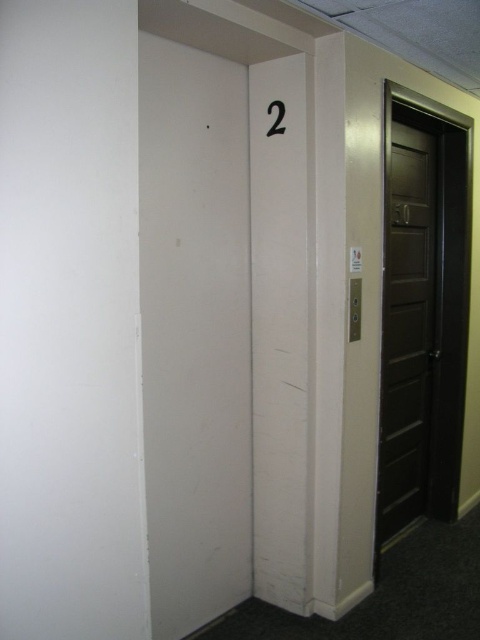
Question: Can you confirm if dark brown wooden door at right is smaller than black paper at upper center?

Choices:
 (A) no
 (B) yes

Answer: (A)

Question: Which point is farther from the camera taking this photo?

Choices:
 (A) (269, 125)
 (B) (385, 230)

Answer: (B)

Question: Is dark brown wooden door at right wider than black paper at upper center?

Choices:
 (A) yes
 (B) no

Answer: (A)

Question: Does dark brown wooden door at right appear under black paper at upper center?

Choices:
 (A) no
 (B) yes

Answer: (B)